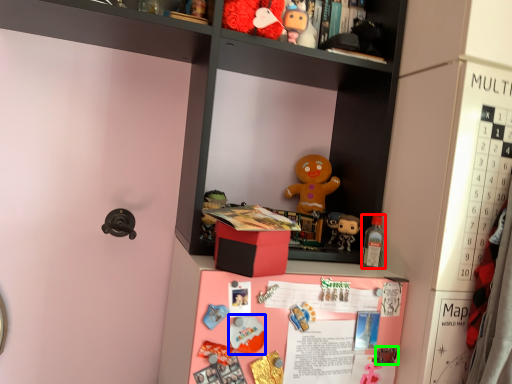
Question: Which object is the farthest from toy (highlighted by a red box)? Choose among these: toy (highlighted by a blue box) or toy (highlighted by a green box).

Choices:
 (A) toy
 (B) toy

Answer: (A)